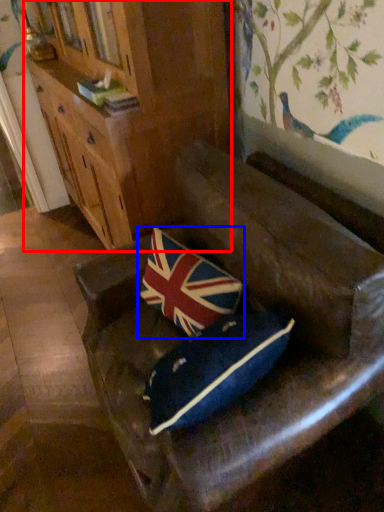
Question: Which of the following is the farthest to the observer, cabinetry (highlighted by a red box) or pillow (highlighted by a blue box)?

Choices:
 (A) cabinetry
 (B) pillow

Answer: (A)